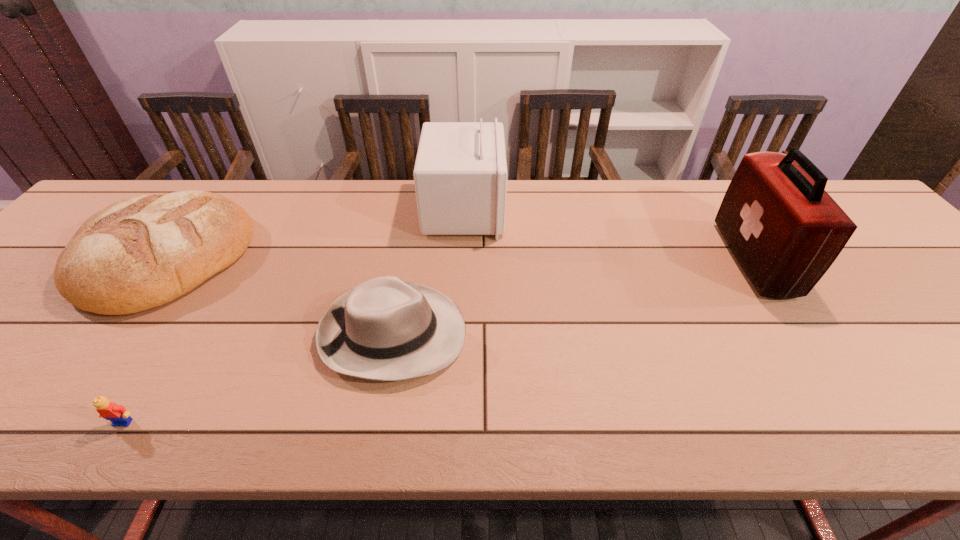
Locate an element on the screen. Image resolution: width=960 pixels, height=540 pixels. blank space that satisfies the following two spatial constraints: 1. on the front-facing side of the left first-aid kit; 2. on the front side of the bread is located at coordinates [x=462, y=258].

Image resolution: width=960 pixels, height=540 pixels. I want to click on free location that satisfies the following two spatial constraints: 1. on the front-facing side of the left first-aid kit; 2. on the face of the shortest object, so click(x=455, y=422).

At what (x,y) coordinates should I click in order to perform the action: click on vacant space that satisfies the following two spatial constraints: 1. on the front-facing side of the fedora; 2. on the face of the nearest object. Please return your answer as a coordinate pair (x, y). The image size is (960, 540). Looking at the image, I should click on (377, 422).